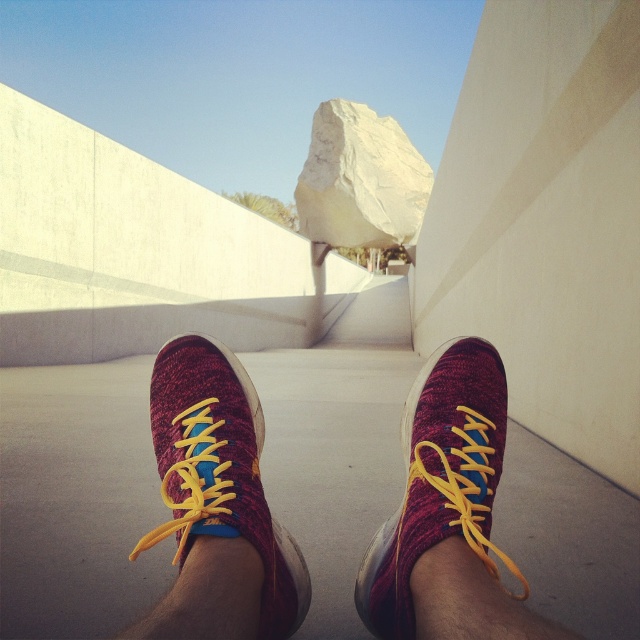
Between knitted/mesh running shoe at center and white smooth rock at center, which one has more height?

white smooth rock at center

Is knitted/mesh running shoe at center closer to camera compared to white smooth rock at center?

Yes, knitted/mesh running shoe at center is closer to the viewer.

Is point (417, 544) in front of point (348, 170)?

Yes, it is in front of point (348, 170).

Locate an element on the screen. This screenshot has height=640, width=640. knitted/mesh running shoe at center is located at coordinates (440, 480).

Who is taller, maroon knit/yarn sneaker at center or white smooth rock at center?

white smooth rock at center is taller.

This screenshot has height=640, width=640. What do you see at coordinates (218, 502) in the screenshot?
I see `maroon knit/yarn sneaker at center` at bounding box center [218, 502].

Who is more forward, (202, 420) or (323, 216)?

Point (202, 420) is more forward.

The image size is (640, 640). What are the coordinates of `maroon knit/yarn sneaker at center` in the screenshot? It's located at (218, 502).

Which is below, knitted fabric sneakers at center or knitted/mesh running shoe at center?

knitted fabric sneakers at center is below.

Does knitted fabric sneakers at center have a larger size compared to knitted/mesh running shoe at center?

Indeed, knitted fabric sneakers at center has a larger size compared to knitted/mesh running shoe at center.

Is point (205, 451) positioned after point (380, 632)?

That is False.

Locate an element on the screen. The height and width of the screenshot is (640, 640). knitted fabric sneakers at center is located at coordinates (216, 504).